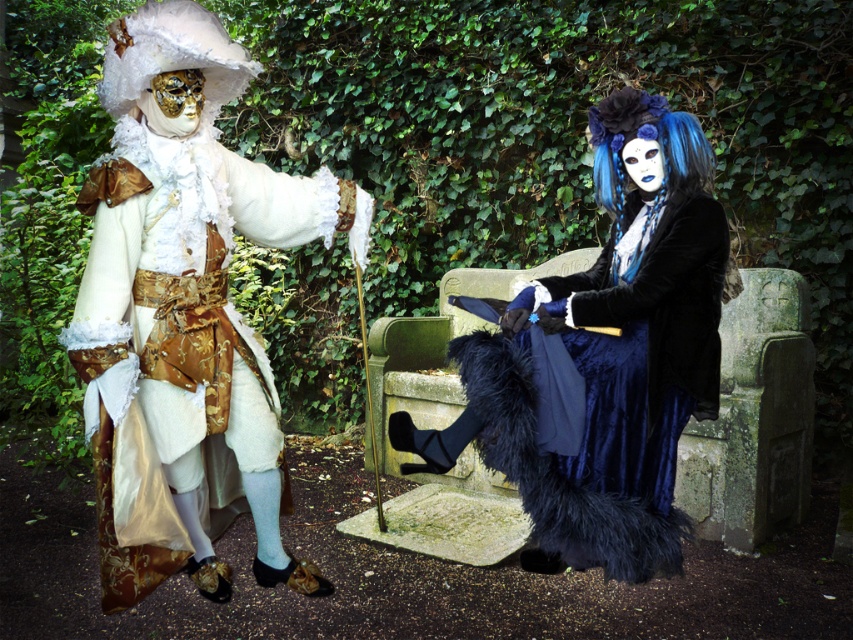
Does matte gold fabric coat at left have a lesser width compared to velvet blue dress at center?

Yes.

Does matte gold fabric coat at left have a greater width compared to velvet blue dress at center?

In fact, matte gold fabric coat at left might be narrower than velvet blue dress at center.

Which is behind, point (151, 506) or point (712, 166)?

The point (712, 166) is more distant.

Find the location of a particular element. matte gold fabric coat at left is located at coordinates (184, 314).